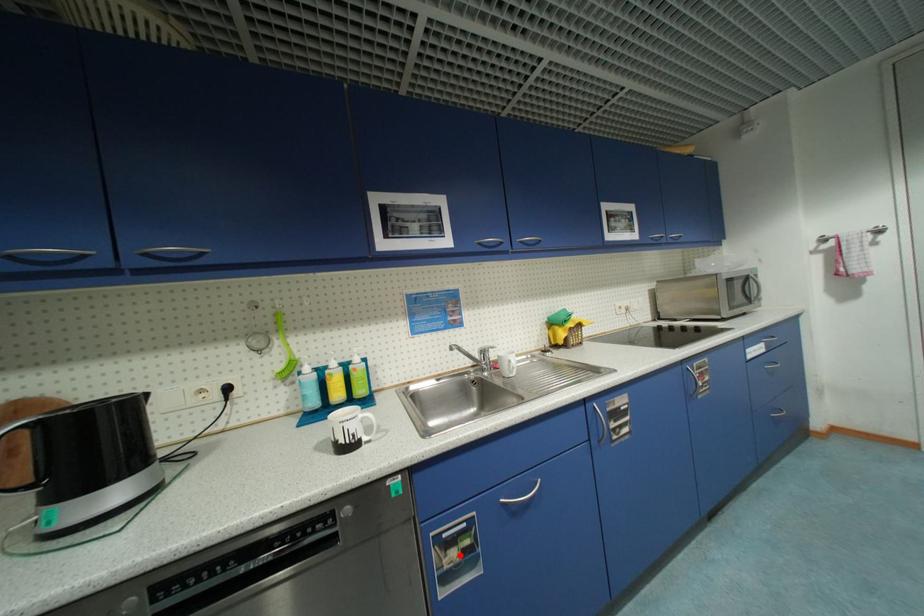
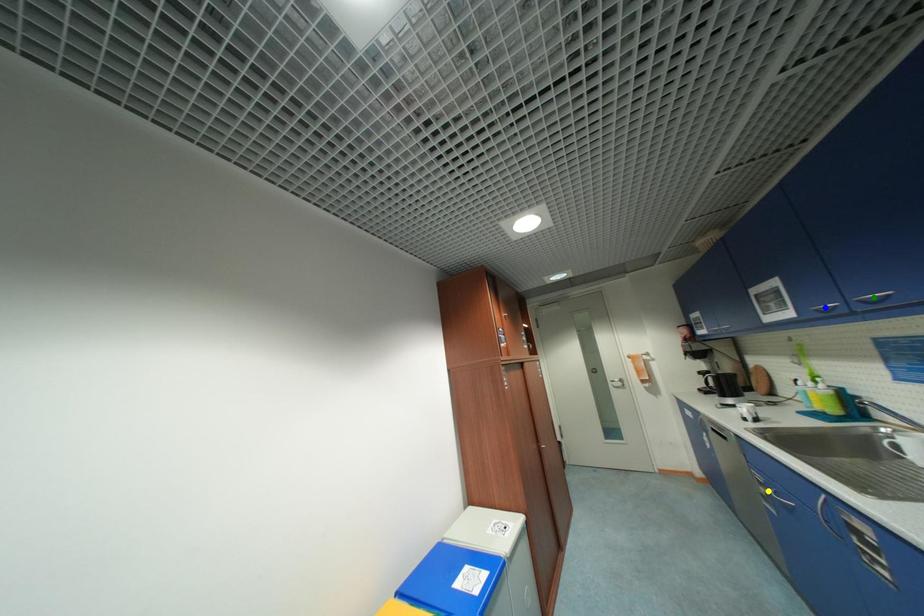
Question: I am providing you with two images of the same scene from different viewpoints. A red point is marked on the first image. You are given multiple points on the second image. Which point in image 2 is actually the same real-world point as the red point in image 1?

Choices:
 (A) yellow point
 (B) green point
 (C) blue point

Answer: (A)